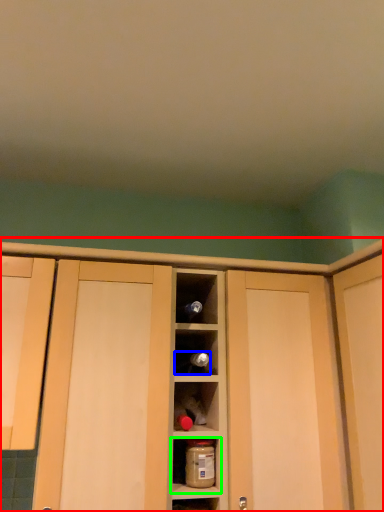
Question: Based on their relative distances, which object is nearer to cabinetry (highlighted by a red box)? Choose from wine bottle (highlighted by a blue box) and shelf (highlighted by a green box).

Choices:
 (A) wine bottle
 (B) shelf

Answer: (A)